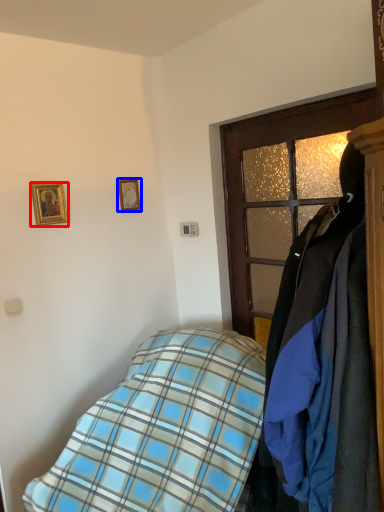
Question: Which of the following is the farthest to the observer, picture frame (highlighted by a red box) or picture frame (highlighted by a blue box)?

Choices:
 (A) picture frame
 (B) picture frame

Answer: (B)